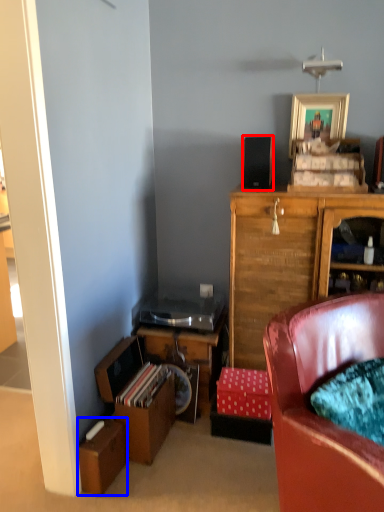
Question: Which of the following is the farthest to the observer, loudspeaker (highlighted by a red box) or cardboard box (highlighted by a blue box)?

Choices:
 (A) loudspeaker
 (B) cardboard box

Answer: (A)